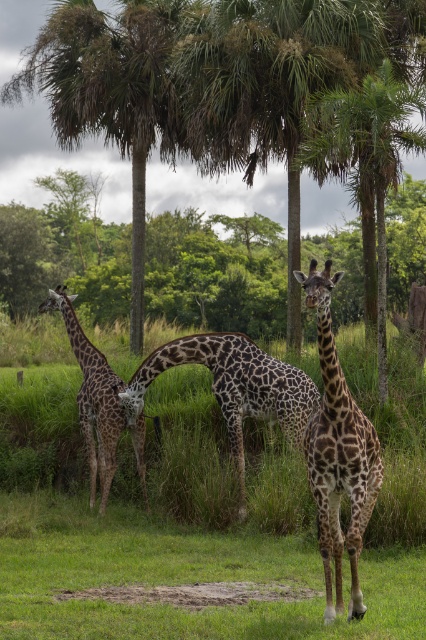
You are a photographer trying to capture a clear photo of the spotted brown giraffe at center. However, there is a green leafy palm tree at upper center in the way. Can you adjust your position to take a photo of the giraffe without the tree blocking it?

The spotted brown giraffe at center is behind the green leafy palm tree at upper center, so adjusting your position to the side might allow you to take a photo of the giraffe without the tree blocking it.

You are a photographer trying to capture a clear shot of the spotted brown giraffe at center without the green leafy tree at center blocking the view. Based on their sizes, which object would you need to position yourself closer to in order to frame the giraffe properly?

The green leafy tree at center is larger in size than the spotted brown giraffe at center. To avoid the tree blocking the view, you should position yourself closer to the spotted brown giraffe at center so that the smaller giraffe fills the frame while the larger tree can be framed around it without obstruction.

You are a photographer trying to capture a photo of the spotted brown giraffe at center without any obstructions. Given that the green leafy palm tree at upper center is wider than the giraffe, would the palm tree block the view of the giraffe in your shot?

The green leafy palm tree at upper center is wider than the spotted brown giraffe at center, so it might block the view of the giraffe depending on the camera angle and distance. To ensure the giraffe is visible, position yourself so the palm tree is not directly in front of the giraffe.